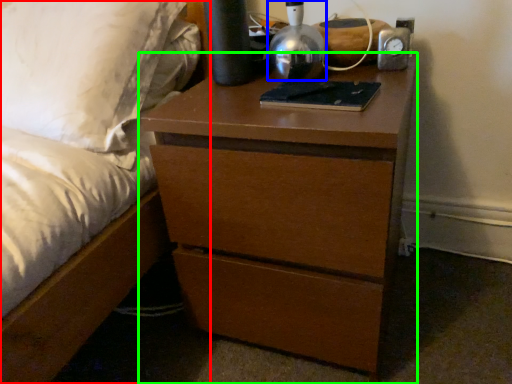
Question: Considering the real-world distances, which object is farthest from bed (highlighted by a red box)? bedside lamp (highlighted by a blue box) or chest of drawers (highlighted by a green box)?

Choices:
 (A) bedside lamp
 (B) chest of drawers

Answer: (A)